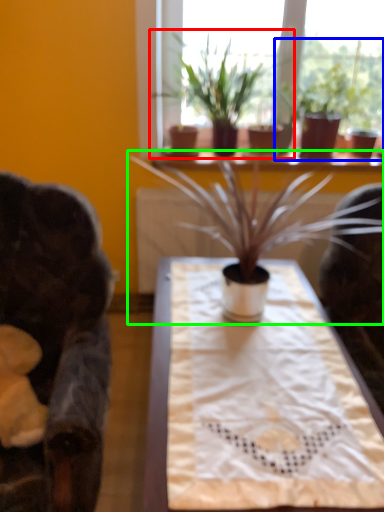
Question: Which is farther away from houseplant (highlighted by a red box)? houseplant (highlighted by a blue box) or houseplant (highlighted by a green box)?

Choices:
 (A) houseplant
 (B) houseplant

Answer: (B)